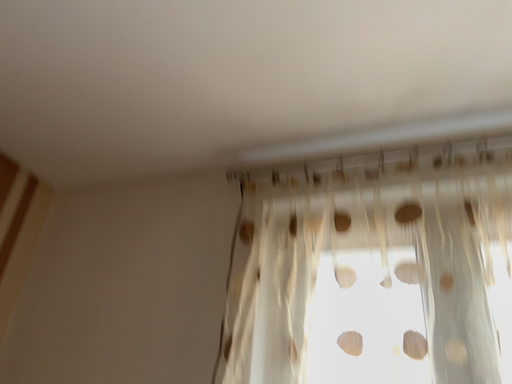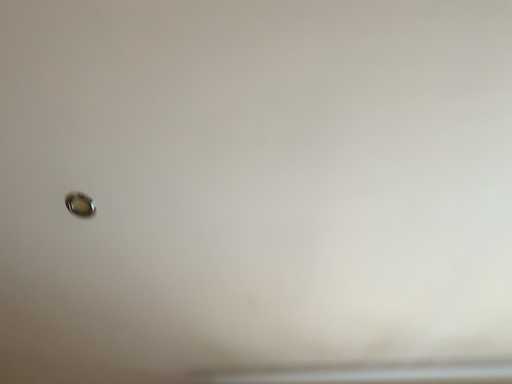
Question: Which way did the camera rotate in the video?

Choices:
 (A) rotated right
 (B) rotated left

Answer: (A)